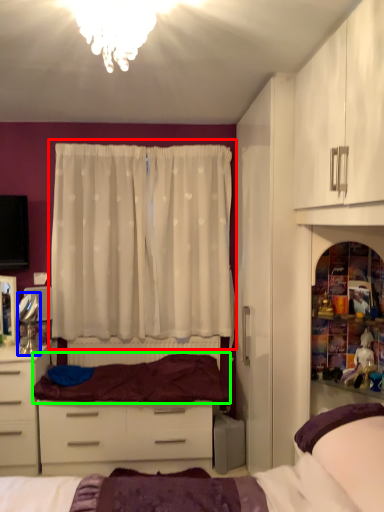
Question: Based on their relative distances, which object is farther from curtain (highlighted by a red box)? Choose from mirror (highlighted by a blue box) and bedding (highlighted by a green box).

Choices:
 (A) mirror
 (B) bedding

Answer: (A)